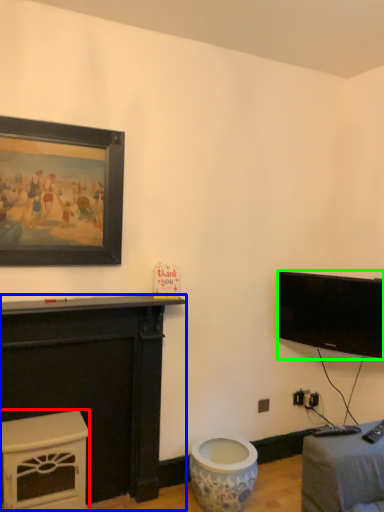
Question: Considering the real-world distances, which object is closest to furniture (highlighted by a red box)? furniture (highlighted by a blue box) or television (highlighted by a green box).

Choices:
 (A) furniture
 (B) television

Answer: (A)